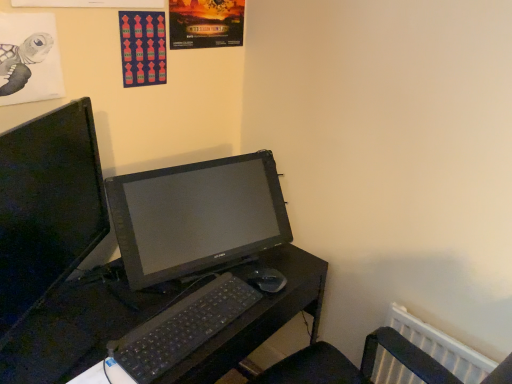
Locate an element on the screen. The width and height of the screenshot is (512, 384). vacant location below black plastic keyboard at center (from a real-world perspective) is located at coordinates (197, 321).